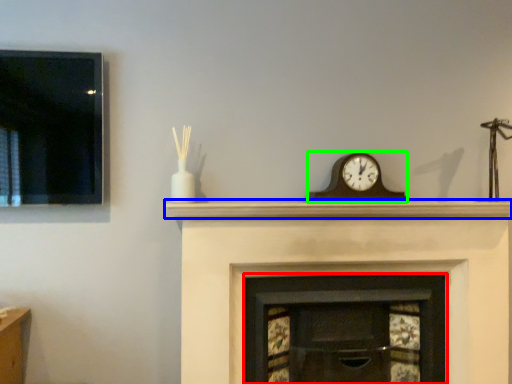
Question: Which object is positioned closest to fireplace (highlighted by a red box)? Select from mantle (highlighted by a blue box) and wall clock (highlighted by a green box).

Choices:
 (A) mantle
 (B) wall clock

Answer: (A)